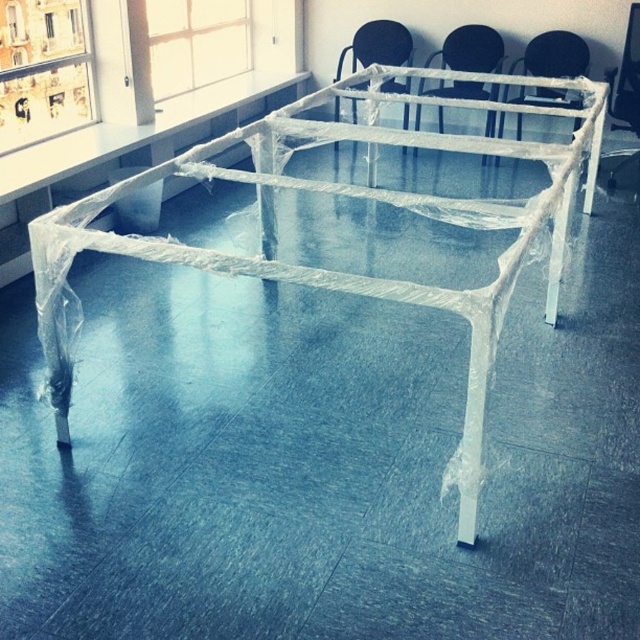
Question: Which of the following is the closest to the observer?

Choices:
 (A) transparent plastic bed frame at center
 (B) clear plastic chair at center
 (C) clear plastic chair at upper center
 (D) transparent plastic chair at upper center

Answer: (A)

Question: Which point is farther to the camera?

Choices:
 (A) (522, 88)
 (B) (476, 68)
 (C) (253, 172)
 (D) (392, 48)

Answer: (D)

Question: Does clear plastic chair at upper center appear over transparent plastic chair at upper center?

Choices:
 (A) yes
 (B) no

Answer: (A)

Question: Based on their relative distances, which object is nearer to the clear plastic chair at upper center?

Choices:
 (A) clear plastic chair at center
 (B) transparent plastic chair at upper center
 (C) transparent plastic bed frame at center

Answer: (B)

Question: Is transparent plastic bed frame at center further to camera compared to clear plastic chair at center?

Choices:
 (A) yes
 (B) no

Answer: (B)

Question: Is transparent plastic bed frame at center bigger than clear plastic chair at center?

Choices:
 (A) yes
 (B) no

Answer: (A)